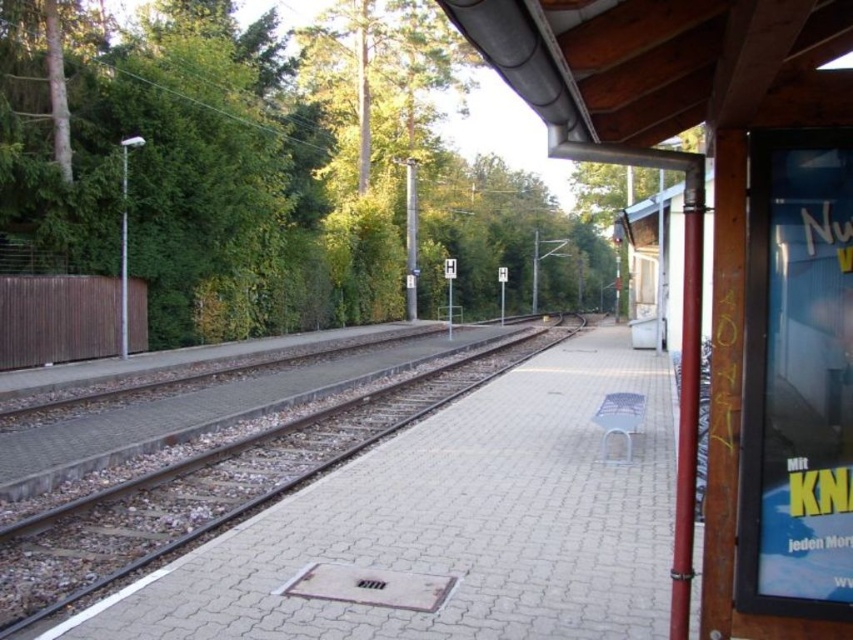
Question: Does blue glossy poster at right have a larger size compared to brown gravel track at center?

Choices:
 (A) yes
 (B) no

Answer: (B)

Question: Does blue glossy poster at right appear over brown gravel track at center?

Choices:
 (A) no
 (B) yes

Answer: (B)

Question: Where is blue glossy poster at right located in relation to brown gravel track at center in the image?

Choices:
 (A) left
 (B) right

Answer: (B)

Question: Which of the following is the closest to the observer?

Choices:
 (A) (74, 529)
 (B) (834, 141)

Answer: (B)

Question: Which point is closer to the camera?

Choices:
 (A) blue glossy poster at right
 (B) brown gravel track at center

Answer: (A)

Question: Which point appears farthest from the camera in this image?

Choices:
 (A) (825, 131)
 (B) (375, 428)

Answer: (B)